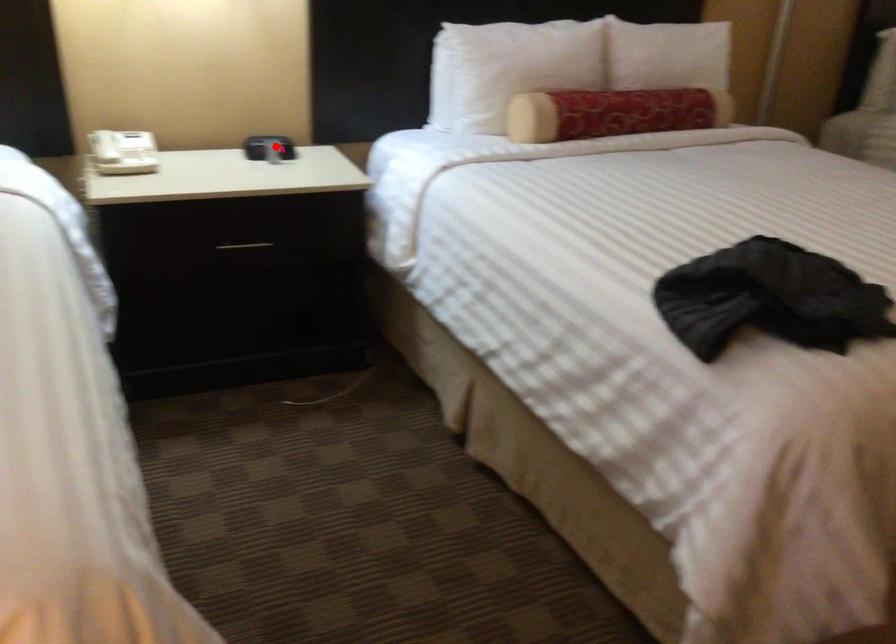
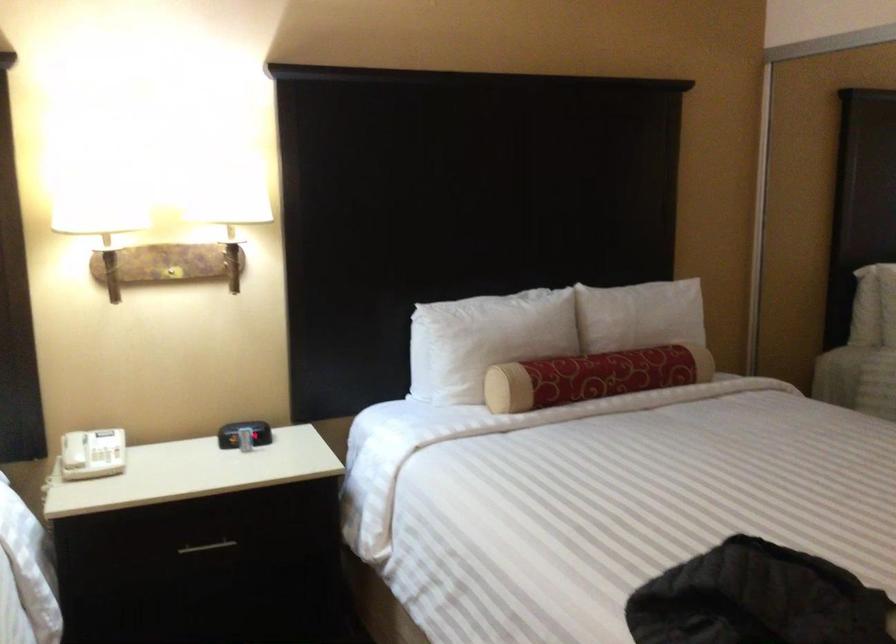
Where in the second image is the point corresponding to the highlighted location from the first image?

(244, 433)